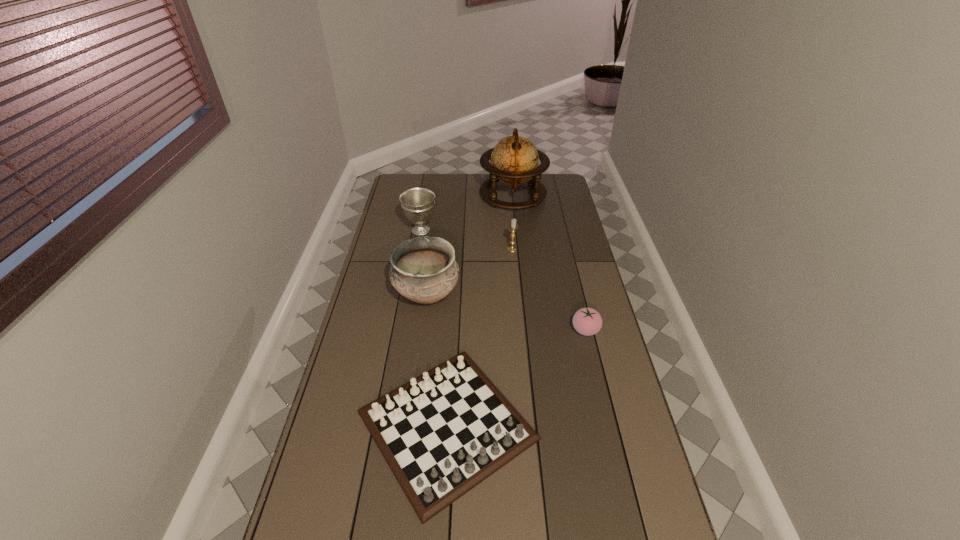
Where is `free space between the farthest object and the nearest object`? Image resolution: width=960 pixels, height=540 pixels. free space between the farthest object and the nearest object is located at coordinates (480, 310).

Where is `vacant region between the pottery and the tomato`? This screenshot has height=540, width=960. vacant region between the pottery and the tomato is located at coordinates (506, 313).

What are the coordinates of `vacant region between the shortest object and the second farthest object` in the screenshot? It's located at (434, 328).

Identify which object is the closest to the chalice. Please provide its 2D coordinates. Your answer should be formatted as a tuple, i.e. [(x, y)], where the tuple contains the x and y coordinates of a point satisfying the conditions above.

[(514, 160)]

Identify which object is the fourth closest to the pottery. Please provide its 2D coordinates. Your answer should be formatted as a tuple, i.e. [(x, y)], where the tuple contains the x and y coordinates of a point satisfying the conditions above.

[(587, 321)]